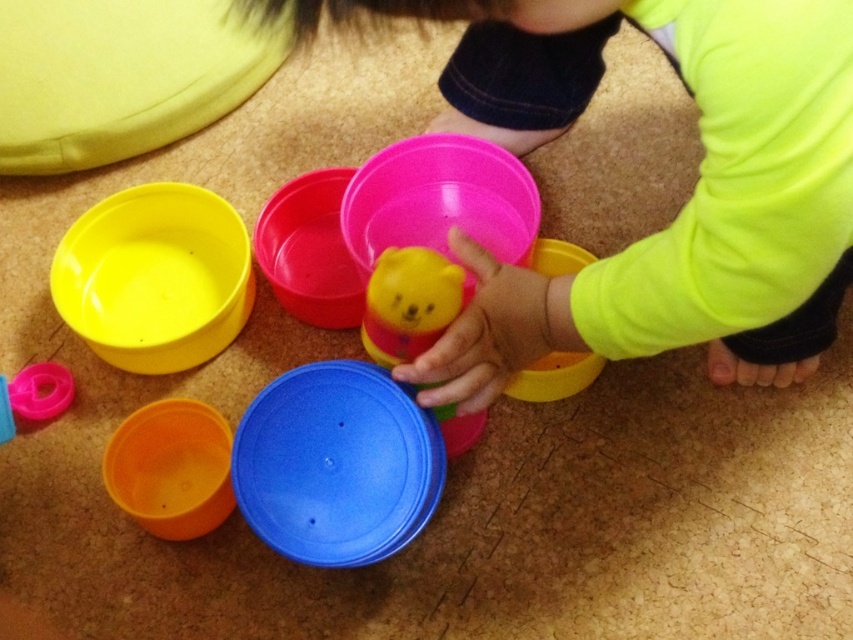
You are a parent observing your child playing with toys on the floor. You notice a point at coordinate (155, 276). What object is located at that point?

The point at coordinate (155, 276) corresponds to the matte plastic bowl at left.